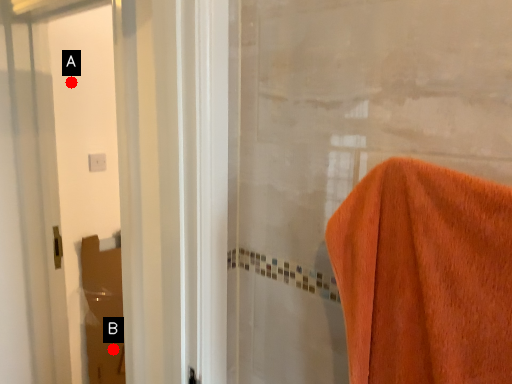
Question: Two points are circled on the image, labeled by A and B beside each circle. Which point is farther to the camera?

Choices:
 (A) A is further
 (B) B is further

Answer: (B)